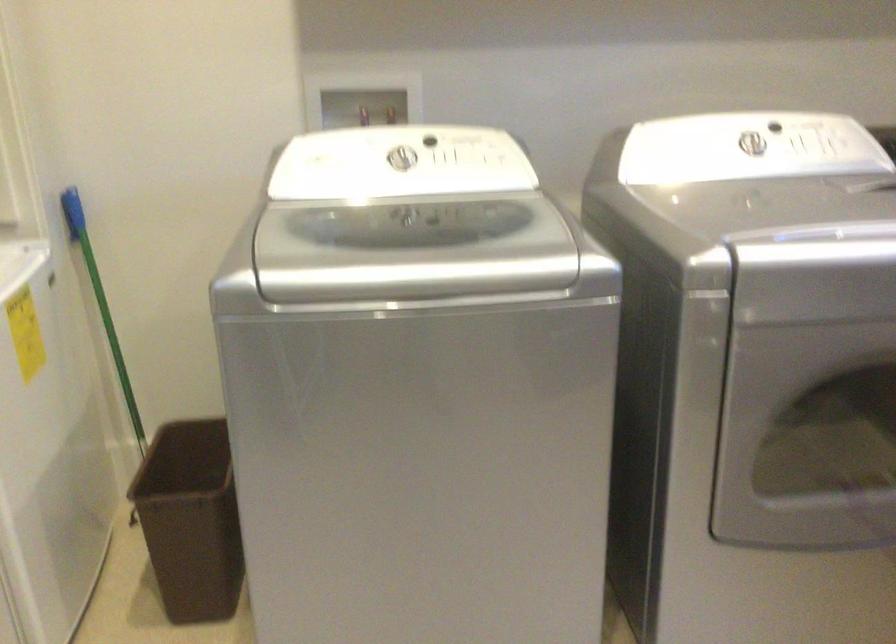
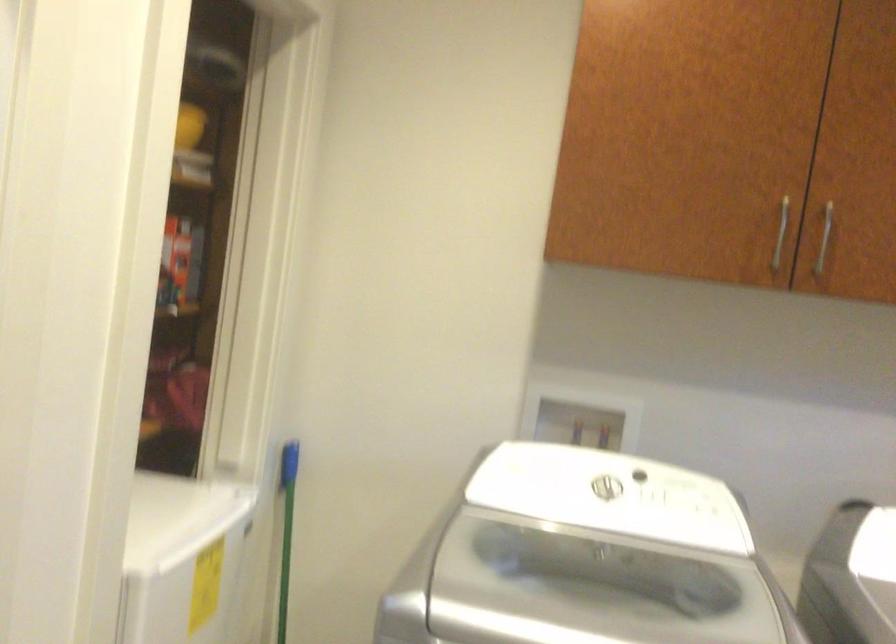
Find the pixel in the second image that matches point 92,281 in the first image.

(286, 529)